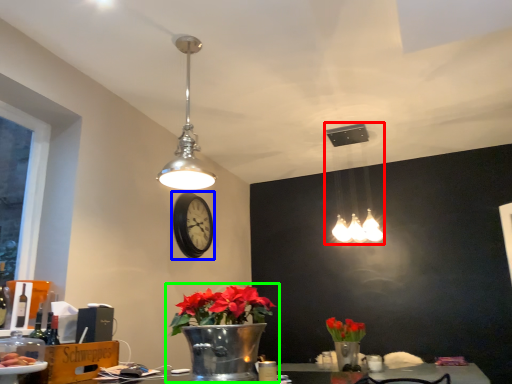
Question: Based on their relative distances, which object is farther from lamp (highlighted by a red box)? Choose from clock (highlighted by a blue box) and houseplant (highlighted by a green box).

Choices:
 (A) clock
 (B) houseplant

Answer: (B)